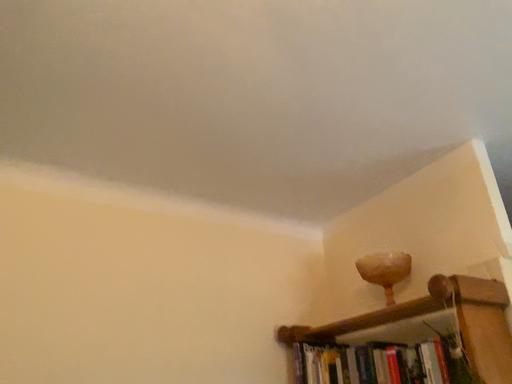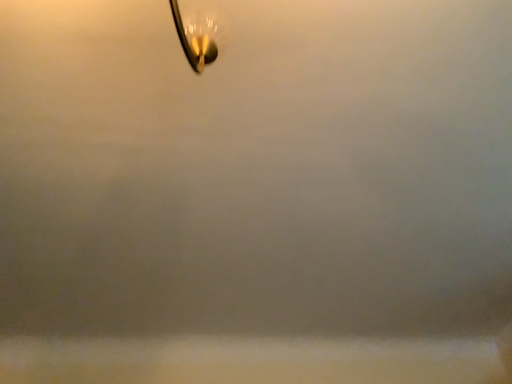
Question: How did the camera likely rotate when shooting the video?

Choices:
 (A) rotated left
 (B) rotated right

Answer: (A)